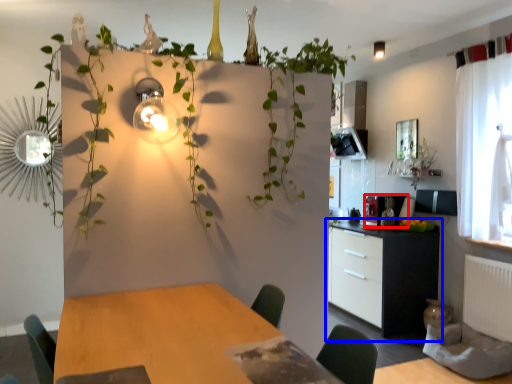
Question: Which point is further to the camera, appliance (highlighted by a red box) or cabinetry (highlighted by a blue box)?

Choices:
 (A) appliance
 (B) cabinetry

Answer: (A)